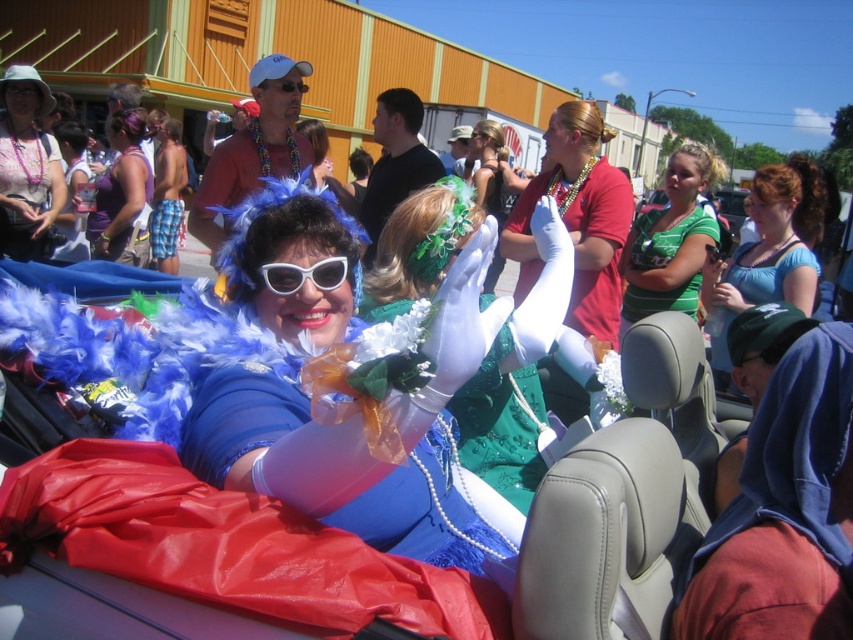
You are a photographer trying to capture the perfect shot of the blue feather boa at upper center. Based on its position in the image, what coordinates should you aim for to center your camera on it?

The blue feather boa at upper center is located at coordinates 0.395 on the x axis and 0.902 on the y axis, so you should aim your camera at those coordinates to center it.

You are taking a photo of the two points in the image. The first point is labeled as point (314, 433) and the second is point (495, 204). Which point will appear larger in your photo?

Point (314, 433) is closer to the camera than point (495, 204), so it will appear larger in the photo.